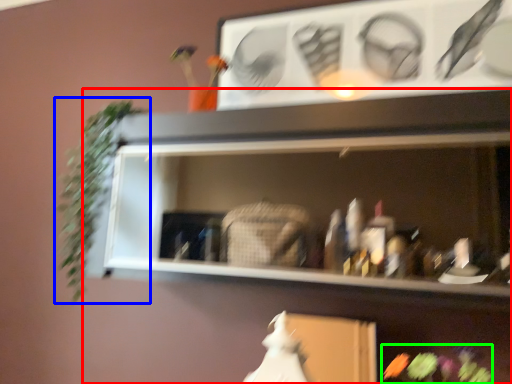
Question: Estimate the real-world distances between objects in this image. Which object is closer to shelf (highlighted by a red box), plant (highlighted by a blue box) or flower (highlighted by a green box)?

Choices:
 (A) plant
 (B) flower

Answer: (B)